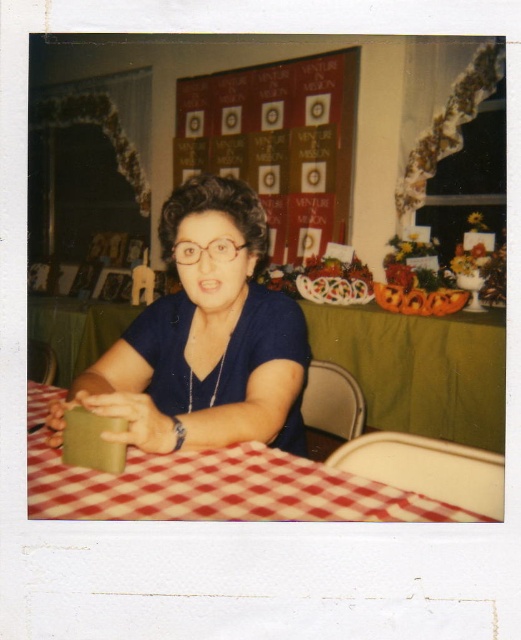
You are looking at a Polaroid photo of a woman seated at a table with a red checkered tablecloth at center. There is also a point marked at coordinates (219, 490). Based on the description, where is this point located?

The point at coordinates (219, 490) corresponds to the red checkered tablecloth at center.

You are setting up a table for a party and have both the red checkered tablecloth at center and the clear plastic glasses at center. Based on their sizes, which item would you place first to ensure proper fitting?

The red checkered tablecloth at center should be placed first because its width is larger than the clear plastic glasses at center, ensuring there is enough space for the glasses to be placed properly on top.